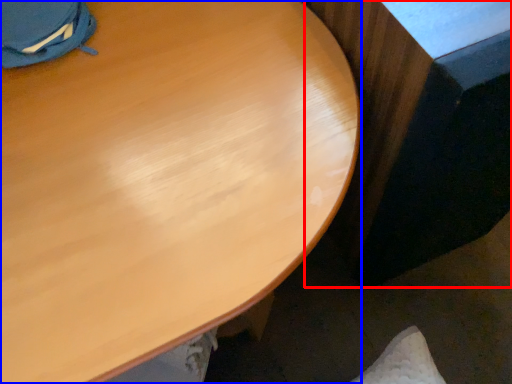
Question: Among these objects, which one is farthest to the camera, table (highlighted by a red box) or desk (highlighted by a blue box)?

Choices:
 (A) table
 (B) desk

Answer: (A)